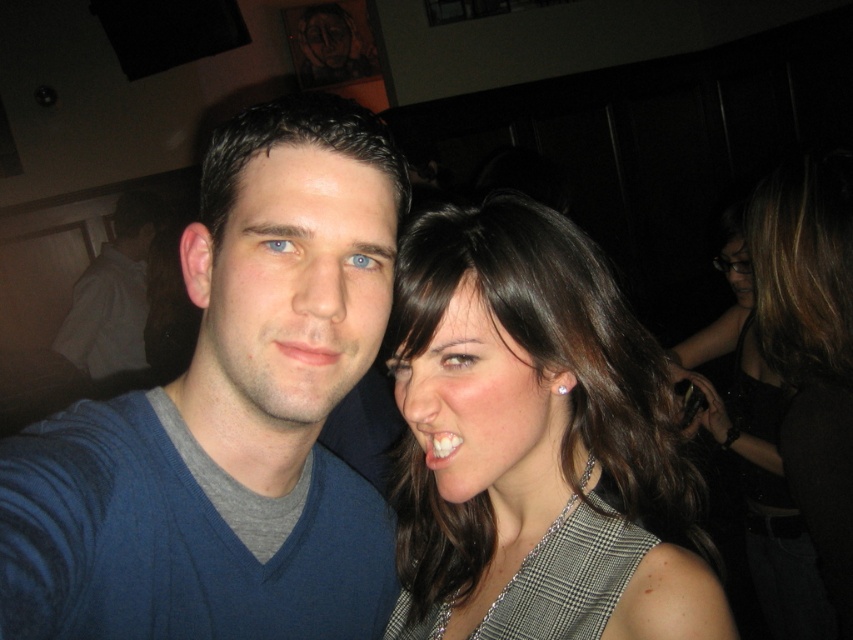
Is blue cotton shirt at left further to camera compared to matte skin at center?

Yes, blue cotton shirt at left is further from the viewer.

Describe the element at coordinates (113, 296) in the screenshot. I see `blue cotton shirt at left` at that location.

At what (x,y) coordinates should I click in order to perform the action: click on blue cotton shirt at left. Please return your answer as a coordinate pair (x, y). The height and width of the screenshot is (640, 853). Looking at the image, I should click on (113, 296).

Between blue cotton sweater at center and blue cotton shirt at left, which one is positioned higher?

blue cotton shirt at left is higher up.

Who is taller, blue cotton sweater at center or blue cotton shirt at left?

blue cotton shirt at left

The width and height of the screenshot is (853, 640). I want to click on blue cotton sweater at center, so click(228, 417).

Can you confirm if plaid fabric dress at right is bigger than white glossy teeth at center?

Yes.

This screenshot has height=640, width=853. Describe the element at coordinates (520, 401) in the screenshot. I see `plaid fabric dress at right` at that location.

Identify the location of plaid fabric dress at right. This screenshot has width=853, height=640. (520, 401).